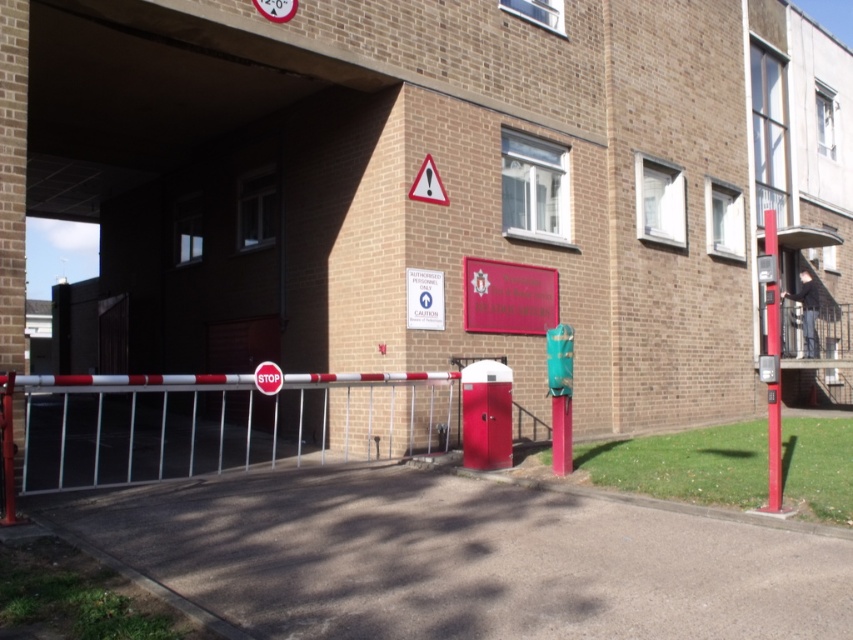
Question: Is red matte sign at center in front of red plastic triangle at upper center?

Choices:
 (A) yes
 (B) no

Answer: (B)

Question: Among these points, which one is farthest from the camera?

Choices:
 (A) (773, 211)
 (B) (473, 264)

Answer: (A)

Question: Can you confirm if metallic red pole at right is positioned to the right of red plastic triangle at upper center?

Choices:
 (A) yes
 (B) no

Answer: (A)

Question: Considering the real-world distances, which object is farthest from the red matte sign at center?

Choices:
 (A) white paper sign at center
 (B) red plastic triangle at upper center

Answer: (B)

Question: In this image, where is red matte sign at center located relative to red plastic triangle at upper center?

Choices:
 (A) right
 (B) left

Answer: (A)

Question: Among these points, which one is farthest from the camera?

Choices:
 (A) (431, 202)
 (B) (436, 323)
 (C) (767, 240)
 (D) (511, 307)

Answer: (C)